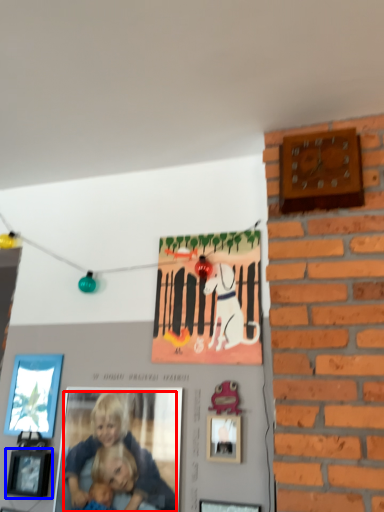
Question: Which of the following is the farthest to the observer, person (highlighted by a red box) or picture frame (highlighted by a blue box)?

Choices:
 (A) person
 (B) picture frame

Answer: (B)